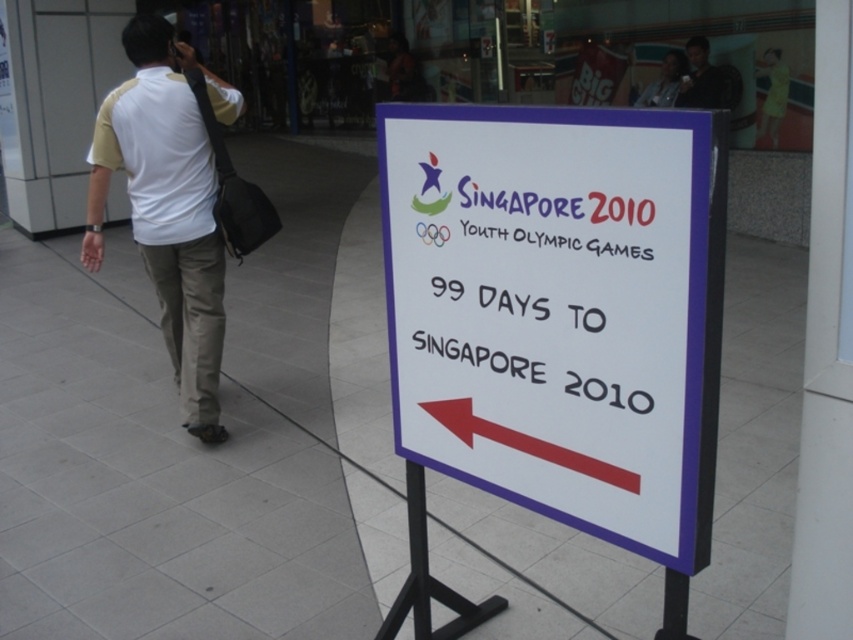
You are holding a rectangular object that is 1 meter wide and want to place it on the pedestrian walkway. The white paper sign at center and the red plastic arrow at lower center are already there. Which object can you place your object next to without overlapping, considering their widths?

The white paper sign at center has a larger width than the red plastic arrow at lower center, so placing your 1 meter wide object next to the red plastic arrow at lower center would be more feasible as it has less width and requires less space.

Based on the photo, you are standing at the point labeled point (149, 99) and want to walk to the point labeled point (111, 381). Based on the scene description, will you have to walk towards the sign or away from it?

Since point (111, 381) is behind point (149, 99), you would need to walk away from the sign to reach it.